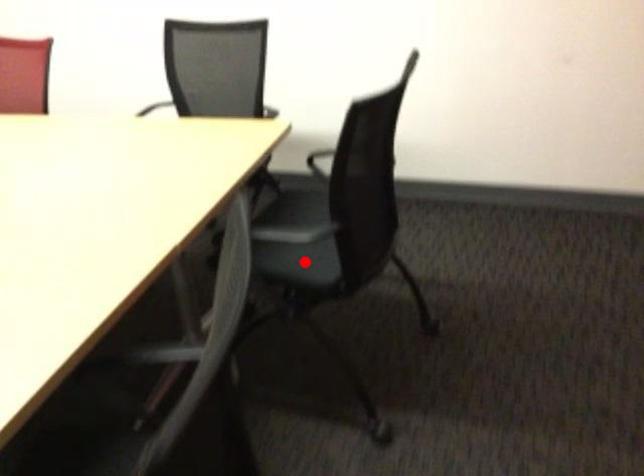
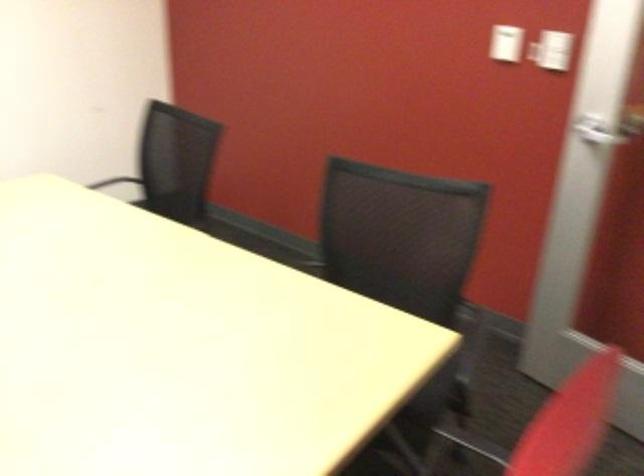
Question: I am providing you with two images of the same scene from different viewpoints. A red point is marked on the first image. At the location where the point appears in image 1, is it still visible in image 2?

Choices:
 (A) Yes
 (B) No

Answer: (B)